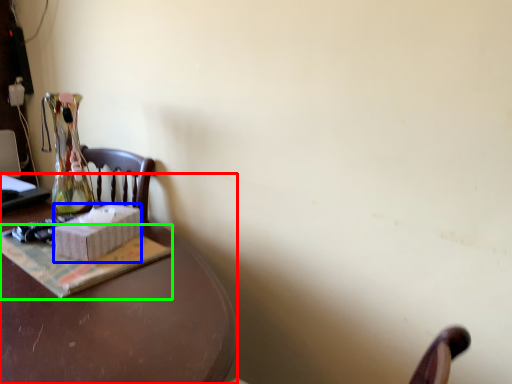
Question: Which is farther away from desk (highlighted by a red box)? box (highlighted by a blue box) or paperback book (highlighted by a green box)?

Choices:
 (A) box
 (B) paperback book

Answer: (A)